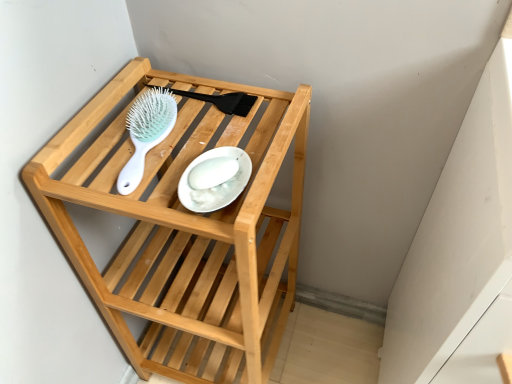
Locate an element on the screen. Image resolution: width=512 pixels, height=384 pixels. vacant space behind light blue plastic hairbrush at upper center is located at coordinates (152, 94).